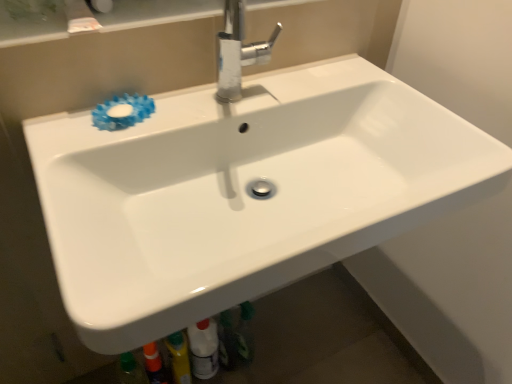
Question: From a real-world perspective, is white glossy bottle at lower center above or below blue rubber flower at upper left?

Choices:
 (A) below
 (B) above

Answer: (A)

Question: In the image, is white glossy bottle at lower center positioned in front of or behind blue rubber flower at upper left?

Choices:
 (A) front
 (B) behind

Answer: (B)

Question: Estimate the real-world distances between objects in this image. Which object is closer to the polished chrome faucet at upper center?

Choices:
 (A) blue rubber flower at upper left
 (B) white glossy bottle at lower center

Answer: (A)

Question: Estimate the real-world distances between objects in this image. Which object is farther from the polished chrome faucet at upper center?

Choices:
 (A) blue rubber flower at upper left
 (B) white glossy bottle at lower center

Answer: (B)